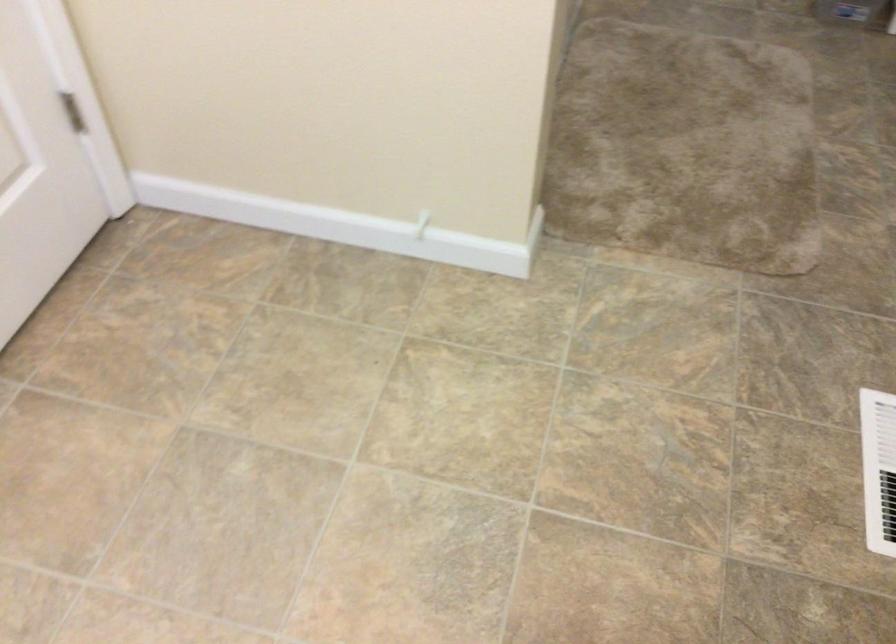
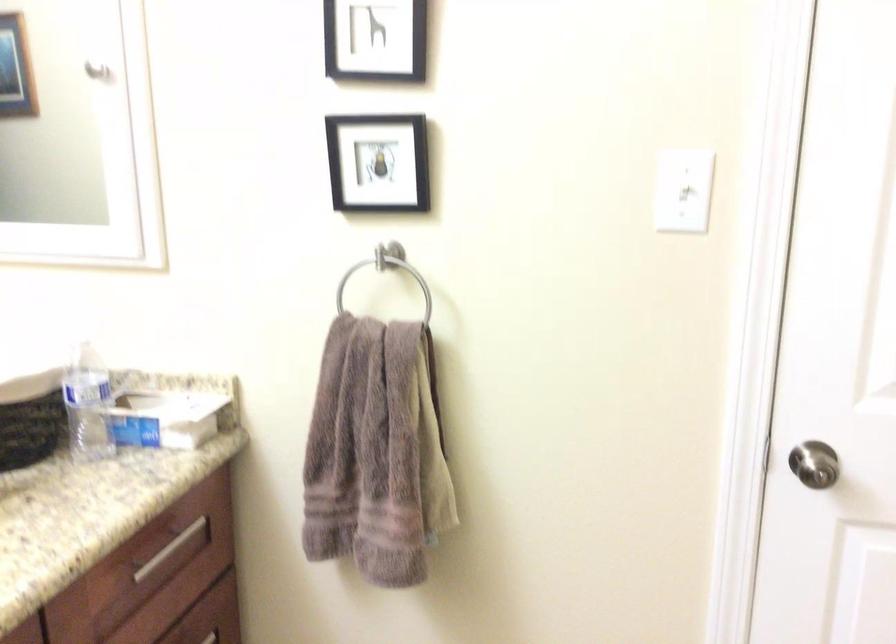
Question: The first image is from the beginning of the video and the second image is from the end. How did the camera likely rotate when shooting the video?

Choices:
 (A) Left
 (B) Right
 (C) Up
 (D) Down

Answer: (A)